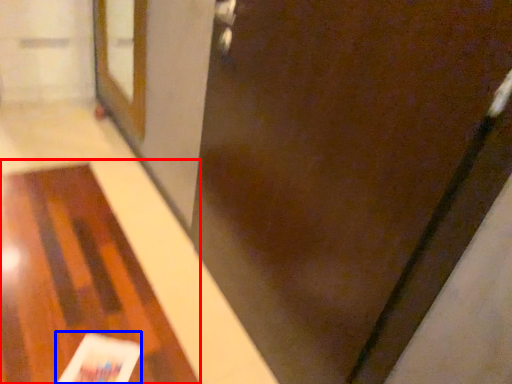
Question: Which object appears farthest to the camera in this image, table (highlighted by a red box) or magazine (highlighted by a blue box)?

Choices:
 (A) table
 (B) magazine

Answer: (B)